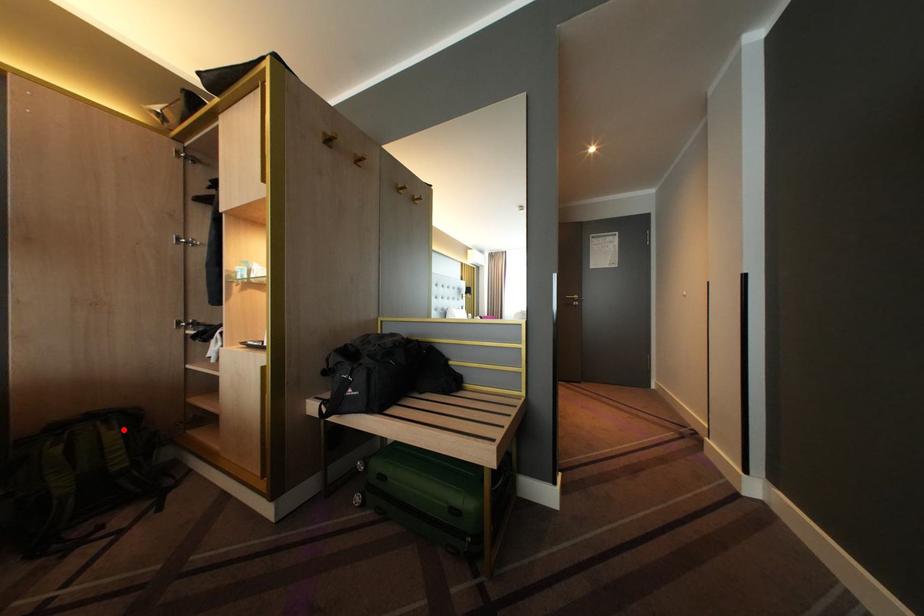
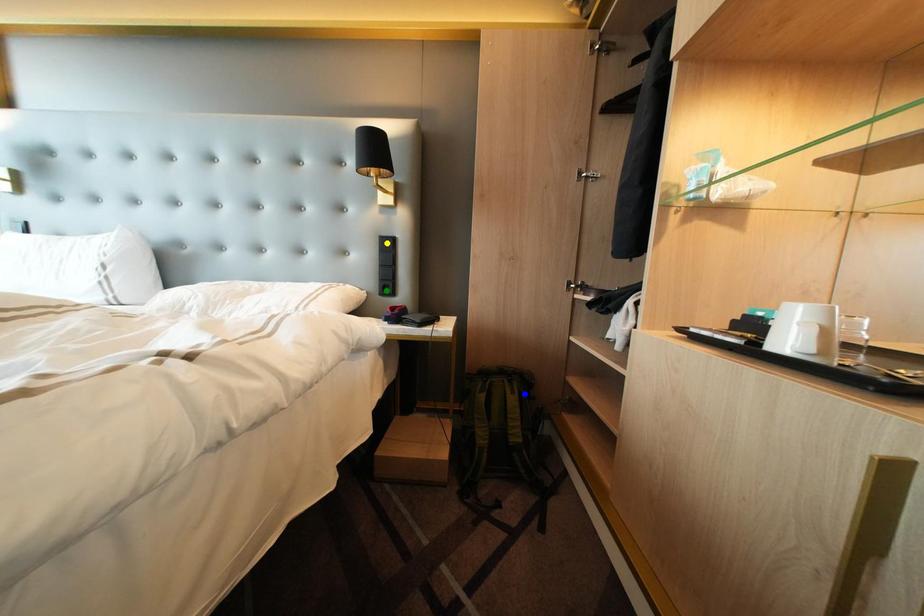
Question: I am providing you with two images of the same scene from different viewpoints. A red point is marked on the first image. You are given multiple points on the second image. Which point in image 2 represents the same 3d spot as the red point in image 1?

Choices:
 (A) yellow point
 (B) blue point
 (C) green point

Answer: (B)